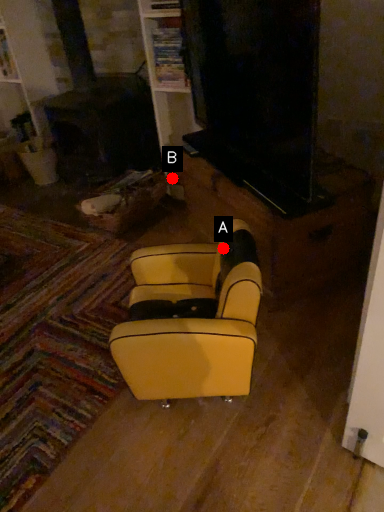
Question: Two points are circled on the image, labeled by A and B beside each circle. Which point is farther from the camera taking this photo?

Choices:
 (A) A is further
 (B) B is further

Answer: (B)